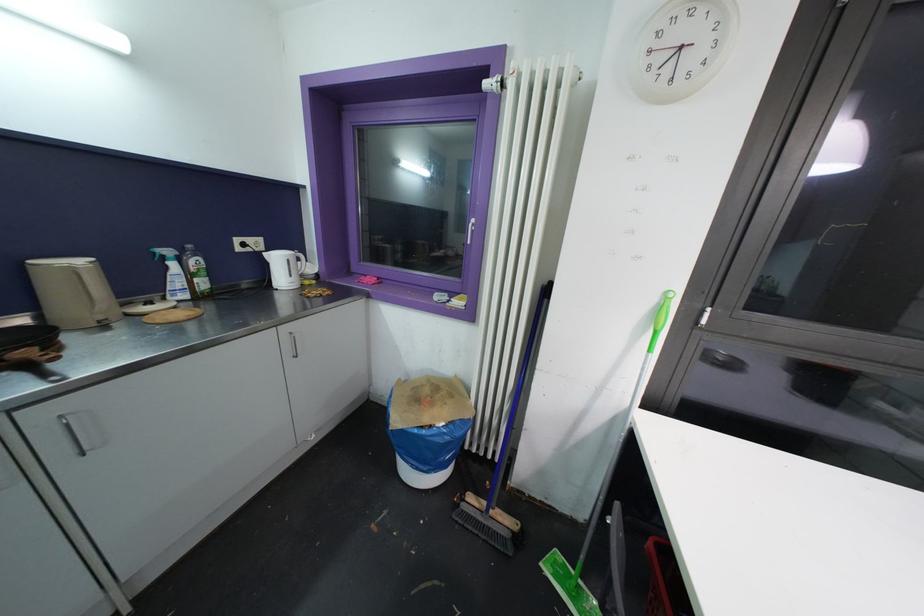
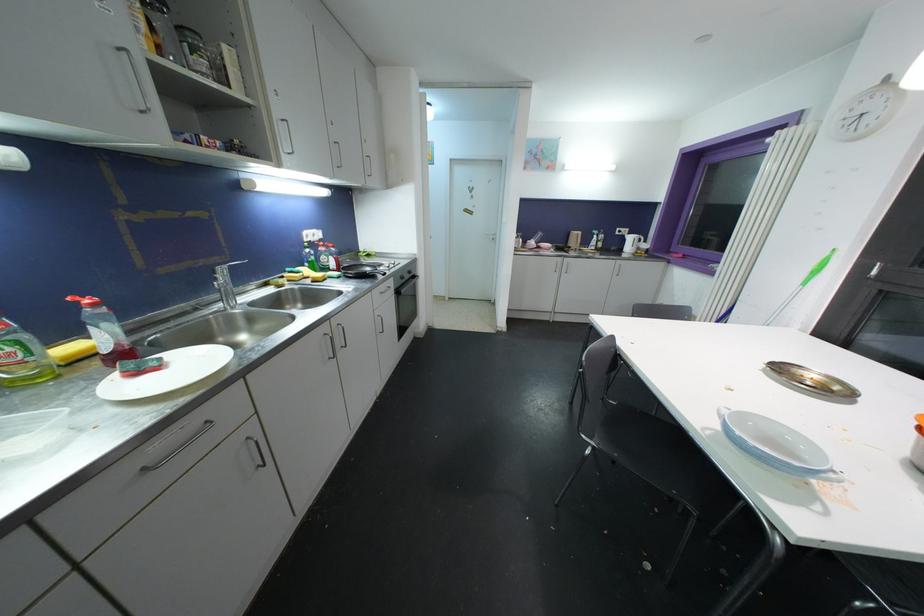
Locate, in the second image, the point that corresponds to point (281, 262) in the first image.

(634, 241)